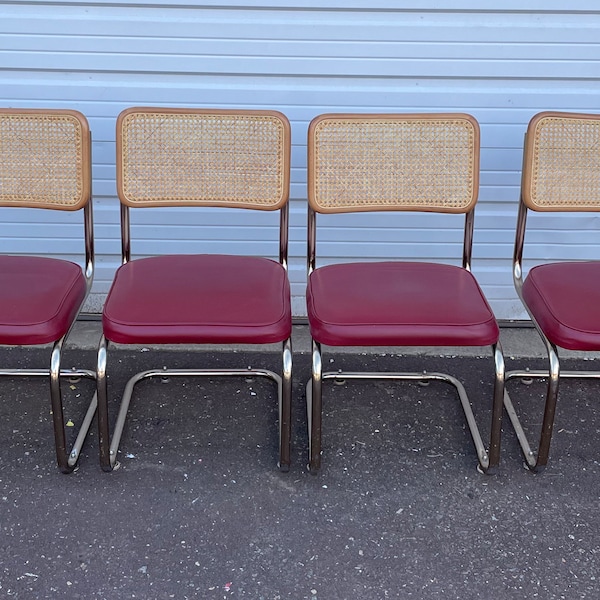
Image resolution: width=600 pixels, height=600 pixels. In order to click on 4 chairs in this screenshot , I will do `click(425, 329)`.